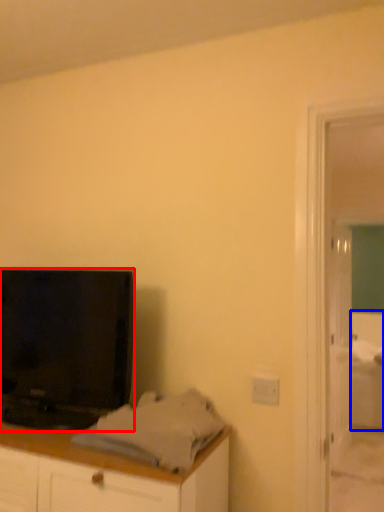
Question: Among these objects, which one is farthest to the camera, television (highlighted by a red box) or bed (highlighted by a blue box)?

Choices:
 (A) television
 (B) bed

Answer: (B)